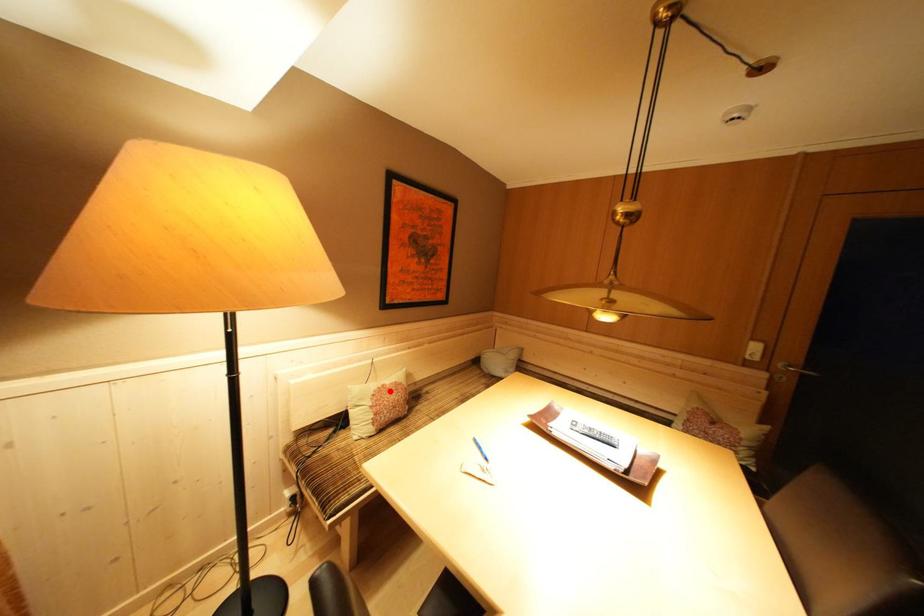
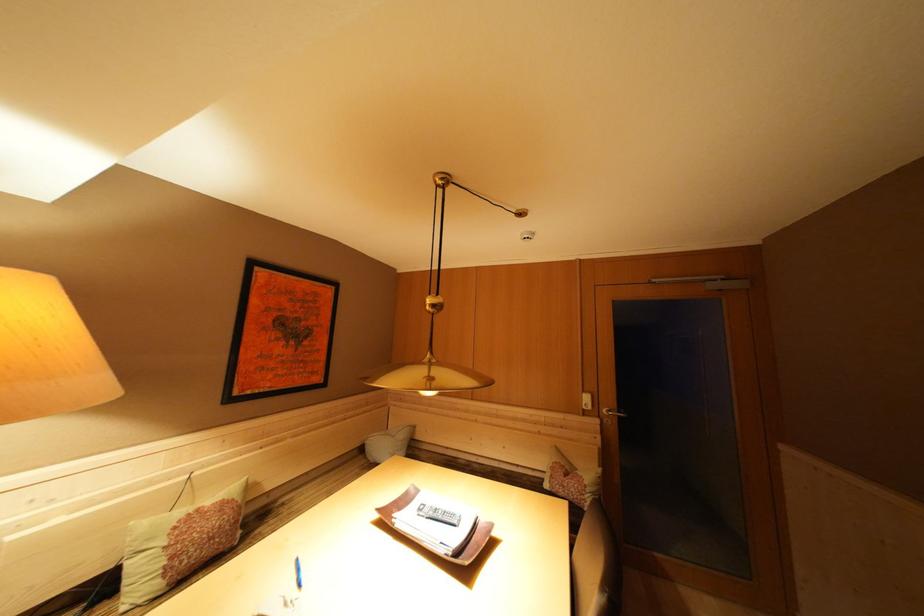
Locate, in the second image, the point that corresponds to the highlighted location in the first image.

(204, 515)